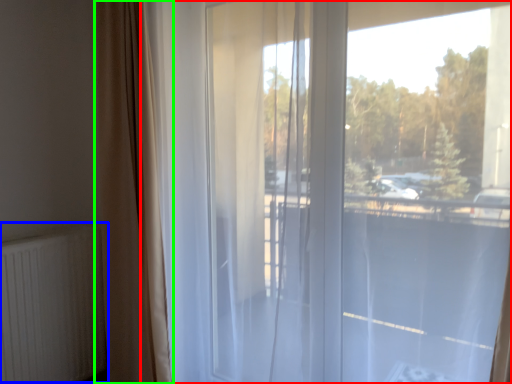
Question: Which object is the farthest from window (highlighted by a red box)? Choose among these: radiator (highlighted by a blue box) or curtain (highlighted by a green box).

Choices:
 (A) radiator
 (B) curtain

Answer: (A)